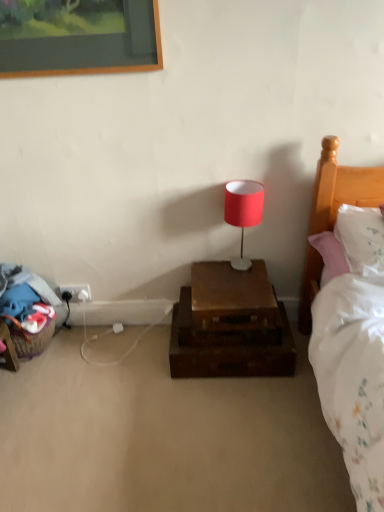
Find the location of `free space to the left of matte red lampshade at center`. free space to the left of matte red lampshade at center is located at coordinates (205, 275).